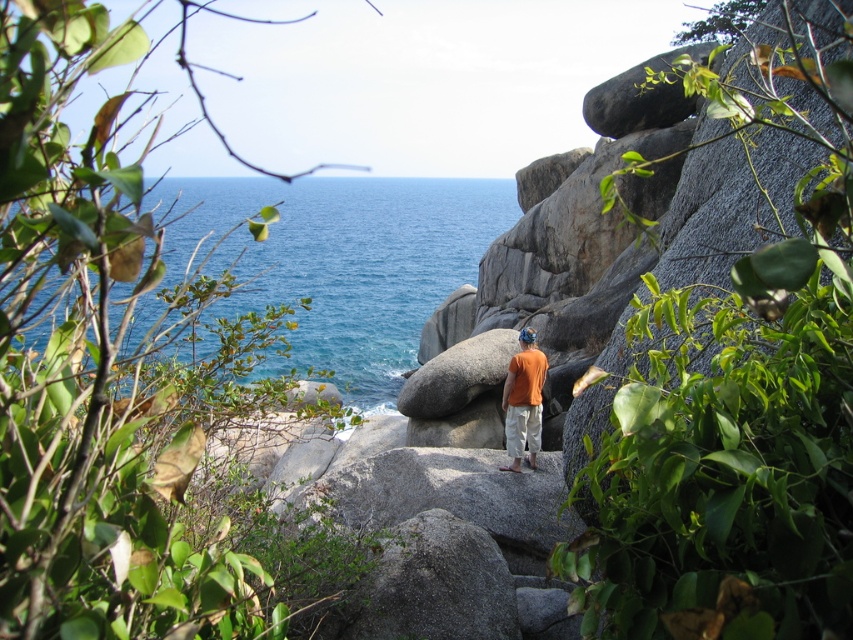
Question: Does blue water at center appear on the left side of orange cotton shirt at center?

Choices:
 (A) no
 (B) yes

Answer: (B)

Question: Which of the following is the closest to the observer?

Choices:
 (A) orange cotton shirt at center
 (B) blue water at center

Answer: (B)

Question: Which point is farther from the camera taking this photo?

Choices:
 (A) (535, 413)
 (B) (389, 388)

Answer: (B)

Question: Can you confirm if blue water at center is positioned to the left of orange cotton shirt at center?

Choices:
 (A) no
 (B) yes

Answer: (B)

Question: Does blue water at center have a greater width compared to orange cotton shirt at center?

Choices:
 (A) yes
 (B) no

Answer: (A)